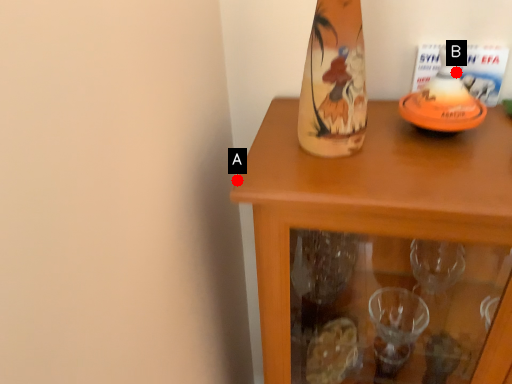
Question: Two points are circled on the image, labeled by A and B beside each circle. Which point is closer to the camera?

Choices:
 (A) A is closer
 (B) B is closer

Answer: (B)